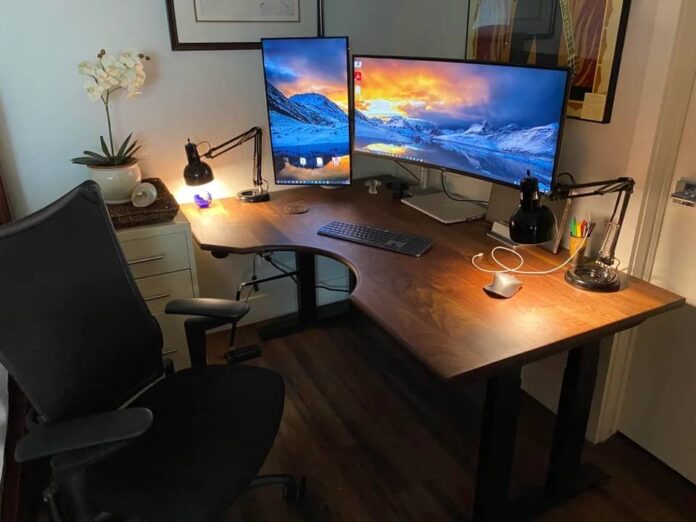
At what (x,y) coordinates should I click in order to perform the action: click on chair arm. Please return your answer as a coordinate pair (x, y). Image resolution: width=696 pixels, height=522 pixels. Looking at the image, I should click on (115, 423), (209, 305).